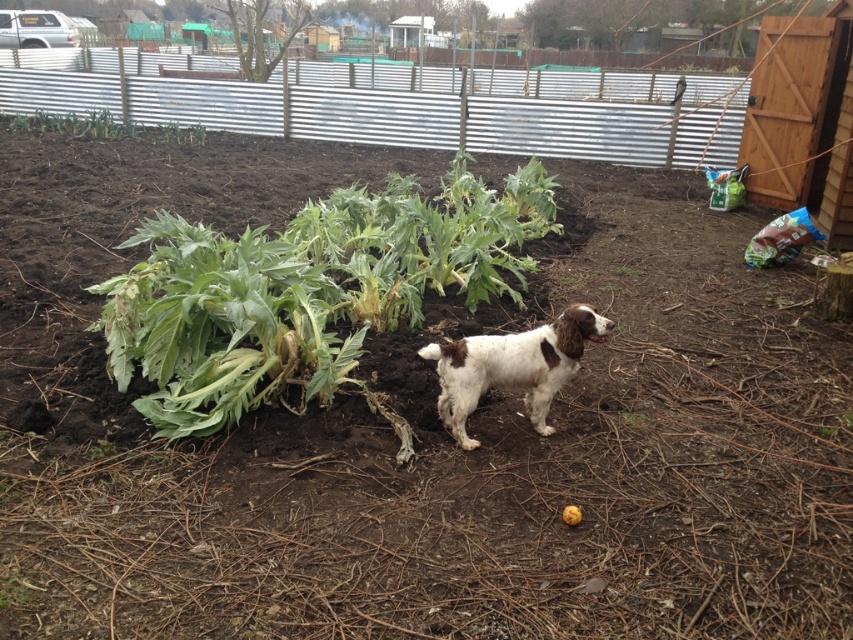
Question: Which object appears closest to the camera in this image?

Choices:
 (A) green leafy plant at center
 (B) white fur dog at center
 (C) green leafy plant at upper left

Answer: (A)

Question: Does green leafy plant at center have a smaller size compared to white fur dog at center?

Choices:
 (A) yes
 (B) no

Answer: (B)

Question: Observing the image, what is the correct spatial positioning of white fur dog at center in reference to green leafy plant at upper left?

Choices:
 (A) right
 (B) left

Answer: (A)

Question: Is green leafy plant at center closer to the viewer compared to green leafy plant at upper left?

Choices:
 (A) no
 (B) yes

Answer: (B)

Question: Which object is positioned farthest from the green leafy plant at center?

Choices:
 (A) white fur dog at center
 (B) green leafy plant at upper left

Answer: (B)

Question: Which of these objects is positioned closest to the white fur dog at center?

Choices:
 (A) green leafy plant at center
 (B) green leafy plant at upper left

Answer: (A)